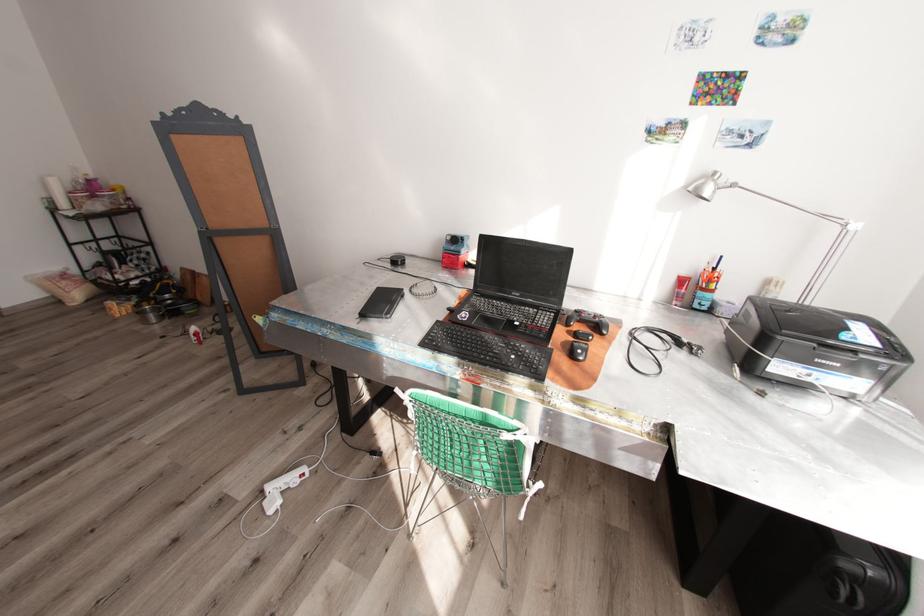
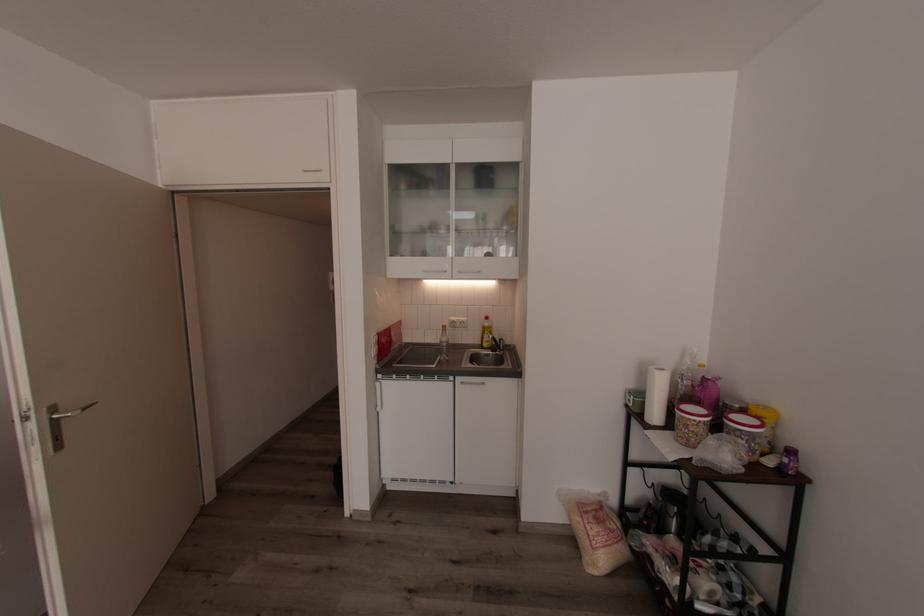
Locate, in the second image, the point that corresponds to (x=81, y=199) in the first image.

(690, 426)